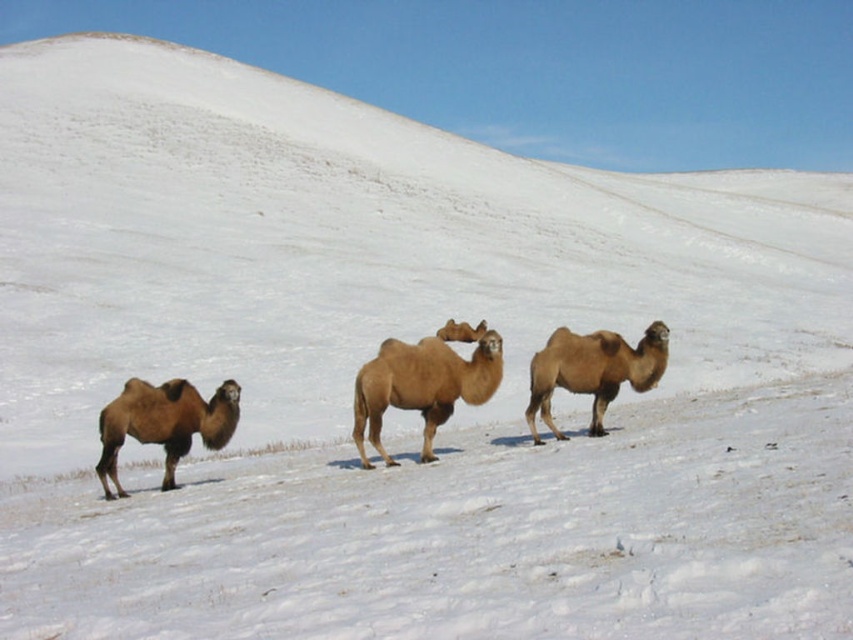
Is light brown woolen camel at center shorter than light brown fur camel at right?

Indeed, light brown woolen camel at center has a lesser height compared to light brown fur camel at right.

Does light brown woolen camel at center appear under light brown fur camel at right?

Correct, light brown woolen camel at center is located below light brown fur camel at right.

Locate an element on the screen. The height and width of the screenshot is (640, 853). light brown woolen camel at center is located at coordinates (421, 387).

Can you confirm if brown fuzzy camel at left is positioned above light brown fur camel at right?

No.

Which is more to the left, brown fuzzy camel at left or light brown fur camel at right?

Positioned to the left is brown fuzzy camel at left.

Locate an element on the screen. The image size is (853, 640). brown fuzzy camel at left is located at coordinates (164, 422).

Is light brown fur camel at right bigger than light brown fur camel at center?

Yes.

Between point (553, 369) and point (479, 333), which one is positioned behind?

The point (479, 333) is behind.

Does point (566, 385) come in front of point (479, 336)?

Yes, it is in front of point (479, 336).

At what (x,y) coordinates should I click in order to perform the action: click on light brown fur camel at right. Please return your answer as a coordinate pair (x, y). The height and width of the screenshot is (640, 853). Looking at the image, I should click on (592, 371).